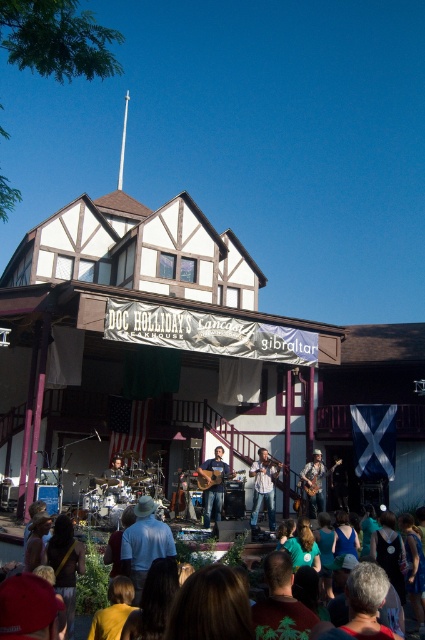
Question: Which point is closer to the camera?

Choices:
 (A) (17, 541)
 (B) (159, 541)

Answer: (B)

Question: Does light blue shirt at center have a larger size compared to matte white shirt at center?

Choices:
 (A) no
 (B) yes

Answer: (A)

Question: Is matte white shirt at center positioned at the back of shiny brown guitar at center?

Choices:
 (A) no
 (B) yes

Answer: (A)

Question: Which point is farther from the camera taking this photo?

Choices:
 (A) (19, 570)
 (B) (214, 474)

Answer: (B)

Question: Can you confirm if light blue shirt at center is positioned to the left of green cotton t-shirt at lower center?

Choices:
 (A) no
 (B) yes

Answer: (B)

Question: Among these points, which one is farthest from the camera?

Choices:
 (A) (122, 541)
 (B) (255, 477)
 (C) (316, 467)
 (D) (204, 497)

Answer: (C)